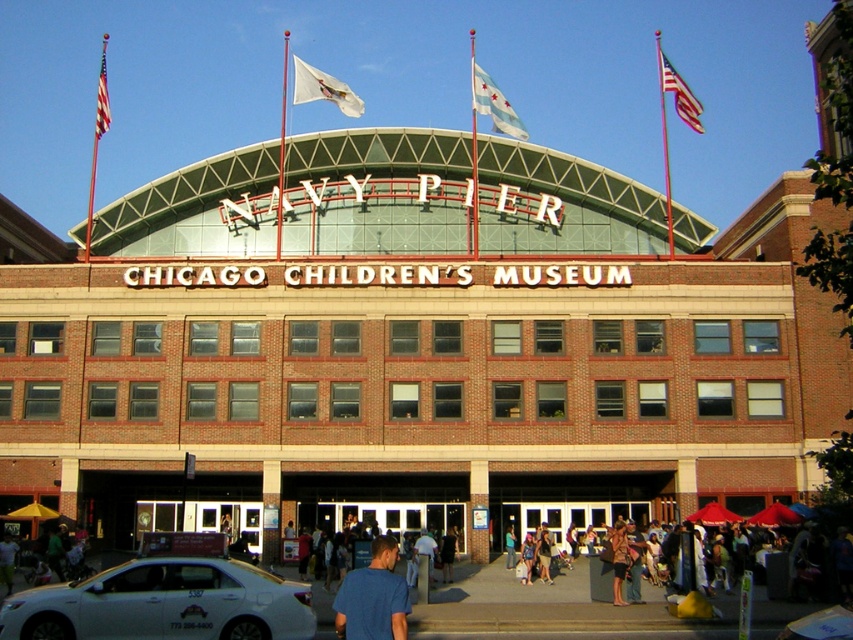
Is point (830, 308) farther from viewer compared to point (335, 100)?

No, it is not.

Measure the distance between point (775, 230) and camera.

Point (775, 230) is 69.78 meters from camera.

This screenshot has height=640, width=853. I want to click on brick building at center, so click(x=415, y=348).

Which of these two, blue t-shirt at center or leather jacket at center, stands taller?

With more height is blue t-shirt at center.

Does blue t-shirt at center appear under leather jacket at center?

Answer: Yes.

In order to click on blue t-shirt at center in this screenshot , I will do `click(373, 596)`.

Does white glossy sedan at lower left appear on the left side of leather jacket at center?

Yes, white glossy sedan at lower left is to the left of leather jacket at center.

Does white glossy sedan at lower left have a lesser width compared to leather jacket at center?

No, white glossy sedan at lower left is not thinner than leather jacket at center.

Image resolution: width=853 pixels, height=640 pixels. Describe the element at coordinates (164, 604) in the screenshot. I see `white glossy sedan at lower left` at that location.

Where is `white glossy sedan at lower left`? The width and height of the screenshot is (853, 640). white glossy sedan at lower left is located at coordinates (x=164, y=604).